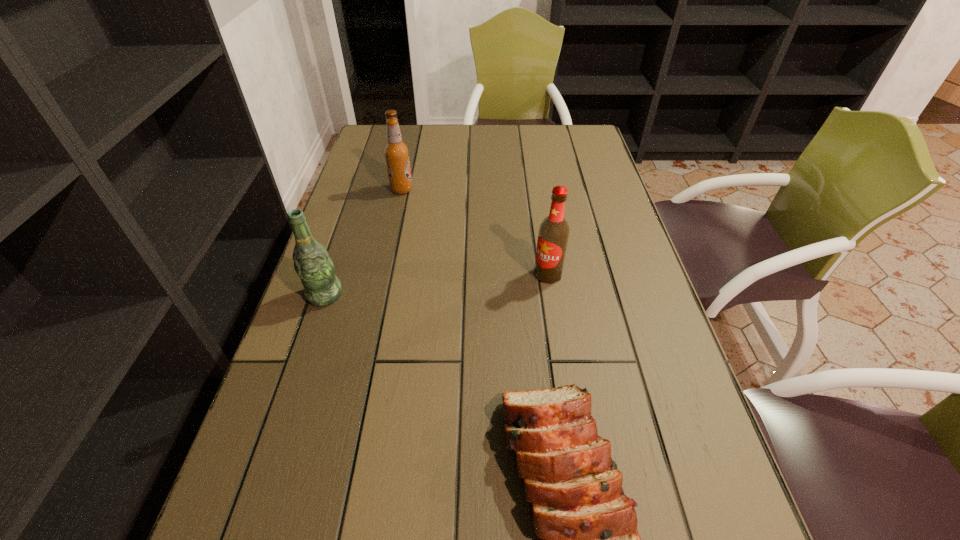
In the image, there is a desktop. Where is `vacant area at the far left corner`? vacant area at the far left corner is located at coordinates (401, 135).

Where is `unoccupied position between the rightmost beer bottle and the leftmost beer bottle`? This screenshot has width=960, height=540. unoccupied position between the rightmost beer bottle and the leftmost beer bottle is located at coordinates (437, 285).

At what (x,y) coordinates should I click in order to perform the action: click on free space between the farthest object and the leftmost beer bottle. Please return your answer as a coordinate pair (x, y). The width and height of the screenshot is (960, 540). Looking at the image, I should click on (364, 242).

You are a GUI agent. You are given a task and a screenshot of the screen. Output one action in this format:
    pyautogui.click(x=<x>, y=<y>)
    Task: Click on the unoccupied position between the rightmost beer bottle and the second beer bottle from right to left
    The height and width of the screenshot is (540, 960).
    Given the screenshot: What is the action you would take?
    pyautogui.click(x=475, y=232)

At what (x,y) coordinates should I click in order to perform the action: click on empty space that is in between the farthest beer bottle and the leftmost object. Please return your answer as a coordinate pair (x, y). The image size is (960, 540). Looking at the image, I should click on (364, 242).

I want to click on object that stands as the third closest to the rightmost beer bottle, so click(312, 263).

Locate which object ranks second in proximity to the rightmost beer bottle. Please provide its 2D coordinates. Your answer should be formatted as a tuple, i.e. [(x, y)], where the tuple contains the x and y coordinates of a point satisfying the conditions above.

[(396, 152)]

Select which beer bottle is the closest to the leftmost beer bottle. Please provide its 2D coordinates. Your answer should be formatted as a tuple, i.e. [(x, y)], where the tuple contains the x and y coordinates of a point satisfying the conditions above.

[(396, 152)]

This screenshot has width=960, height=540. I want to click on beer bottle that stands as the second closest to the rightmost beer bottle, so click(x=312, y=263).

Locate an element on the screen. This screenshot has width=960, height=540. free space that satisfies the following two spatial constraints: 1. on the front label of the rightmost beer bottle; 2. on the right side of the second object from left to right is located at coordinates (383, 274).